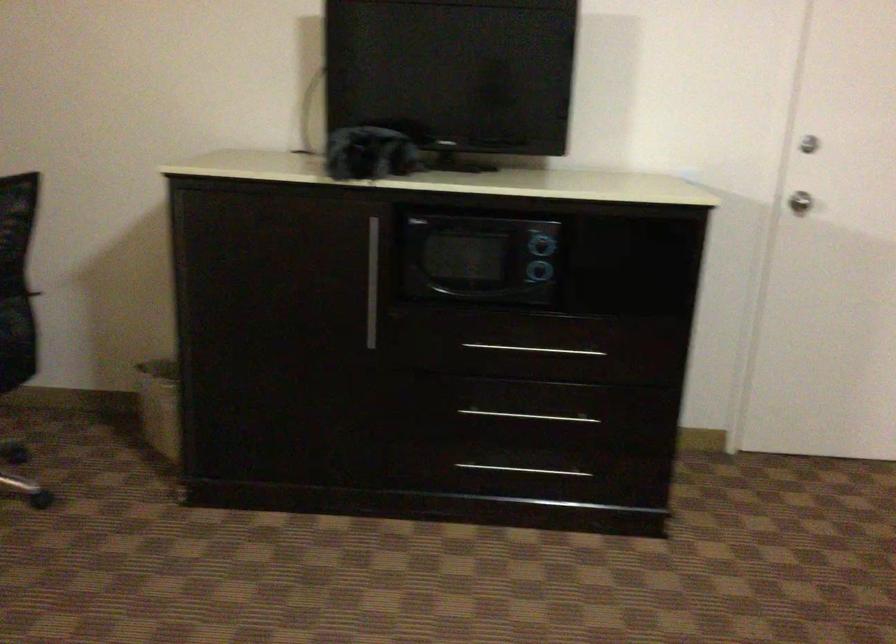
Find where to pull the silver drawer handle. Please return your answer as a coordinate pair (x, y).

(372, 283)